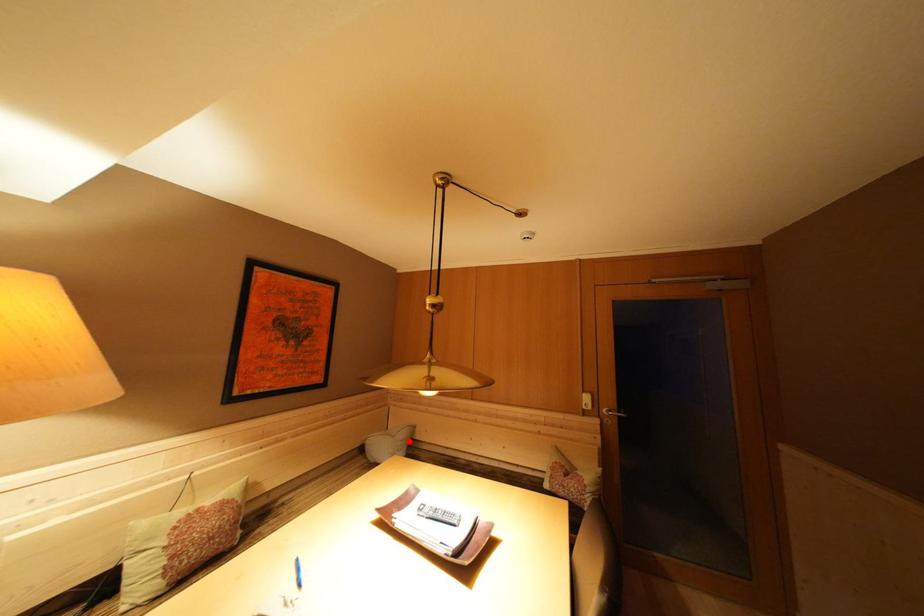
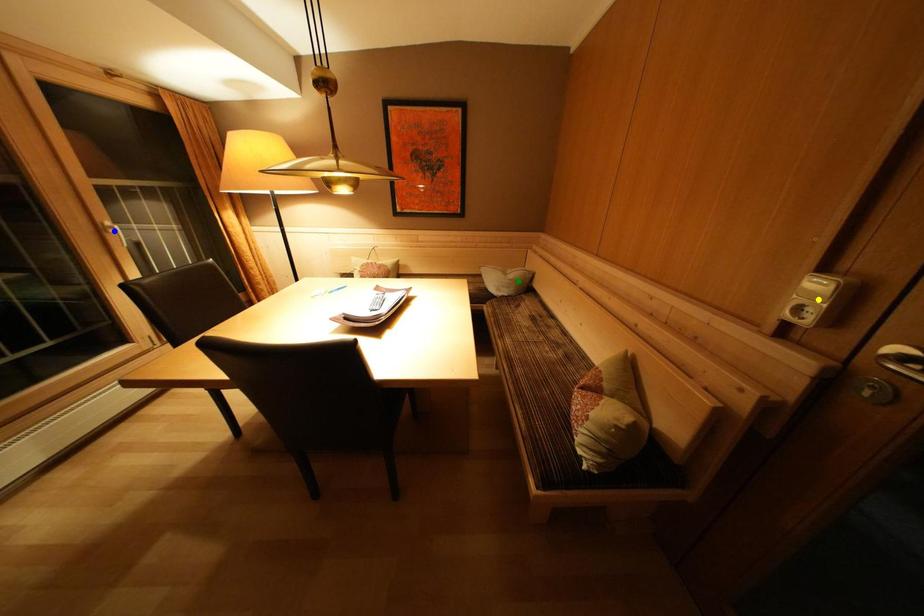
Question: I am providing you with two images of the same scene from different viewpoints. A red point is marked on the first image. You are given multiple points on the second image. Can you choose the point in image 2 that corresponds to the point in image 1?

Choices:
 (A) blue point
 (B) yellow point
 (C) green point

Answer: (C)